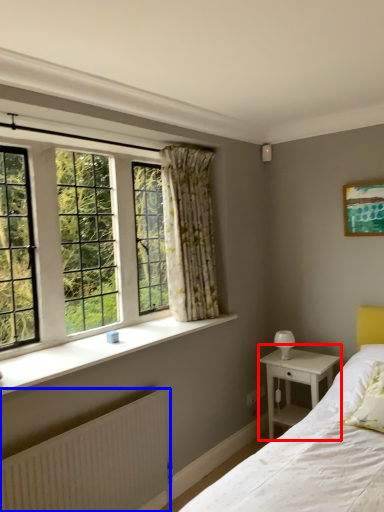
Question: Which object appears farthest to the camera in this image, nightstand (highlighted by a red box) or radiator (highlighted by a blue box)?

Choices:
 (A) nightstand
 (B) radiator

Answer: (A)